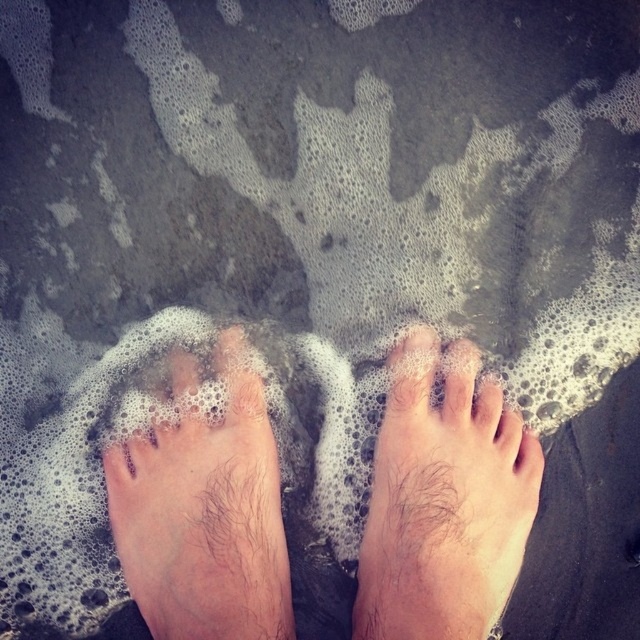
Can you confirm if hairy skin feet at center is positioned above hairy skin foot at lower left?

Yes.

Who is more forward, (432, 609) or (259, 522)?

Point (432, 609)

The height and width of the screenshot is (640, 640). What are the coordinates of `hairy skin feet at center` in the screenshot? It's located at (497, 515).

Which of these two, hairy skin foot at lower center or hairy skin foot at lower left, stands shorter?

hairy skin foot at lower center is shorter.

Looking at this image, can you confirm if hairy skin foot at lower center is positioned to the right of hairy skin foot at lower left?

Correct, you'll find hairy skin foot at lower center to the right of hairy skin foot at lower left.

This screenshot has height=640, width=640. Describe the element at coordinates (444, 500) in the screenshot. I see `hairy skin foot at lower center` at that location.

Where is `hairy skin foot at lower center`? hairy skin foot at lower center is located at coordinates pyautogui.click(x=444, y=500).

Is hairy skin feet at center wider than hairy skin foot at lower center?

Yes, hairy skin feet at center is wider than hairy skin foot at lower center.

Is point (419, 637) more distant than point (396, 396)?

No, it is not.

Does point (529, 499) come farther from viewer compared to point (490, 584)?

Yes.

You are a GUI agent. You are given a task and a screenshot of the screen. Output one action in this format:
    pyautogui.click(x=<x>, y=<y>)
    Task: Click on the hairy skin feet at center
    
    Given the screenshot: What is the action you would take?
    pyautogui.click(x=497, y=515)